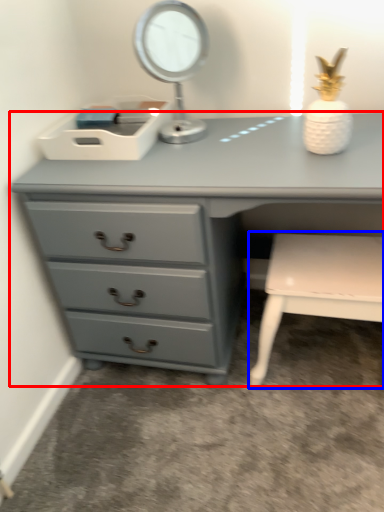
Question: Which of the following is the farthest to the observer, chest of drawers (highlighted by a red box) or chair (highlighted by a blue box)?

Choices:
 (A) chest of drawers
 (B) chair

Answer: (B)